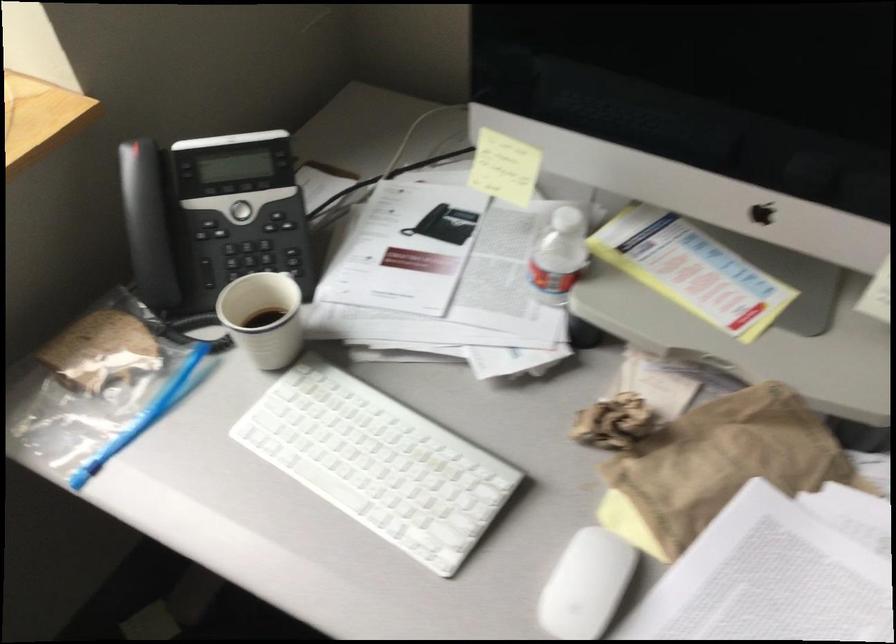
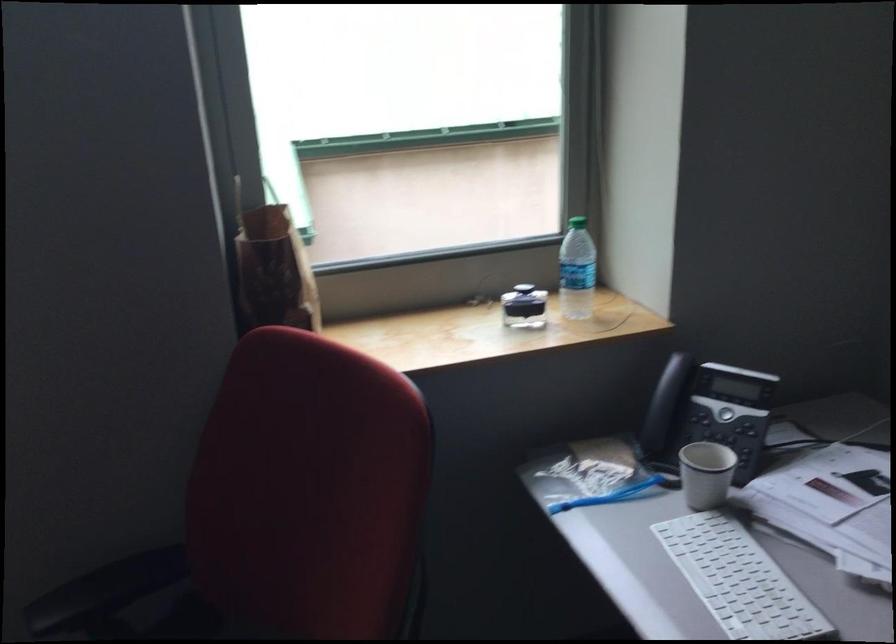
The point at (205, 225) is marked in the first image. Where is the corresponding point in the second image?

(707, 413)